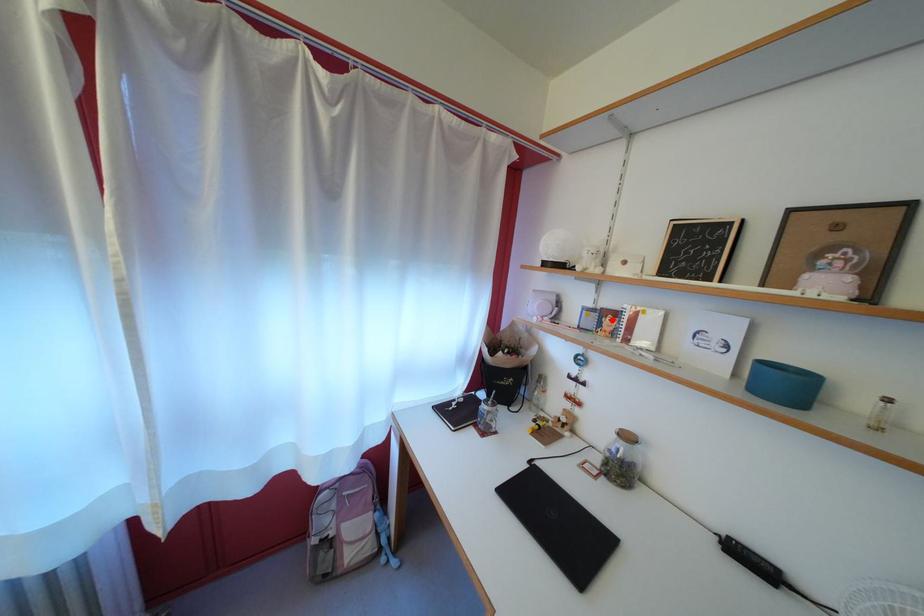
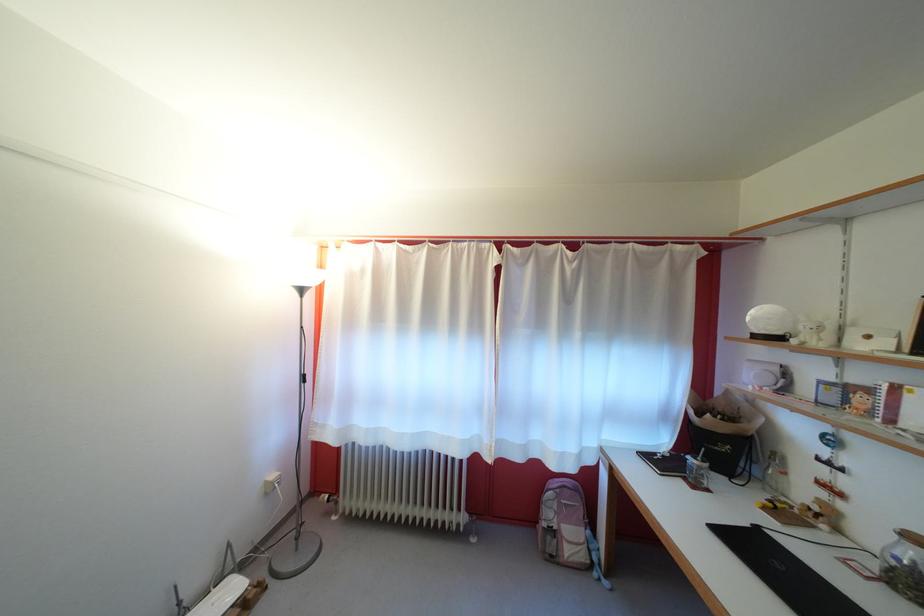
Where in the second image is the point corresponding to the highlighted location from the first image?

(855, 395)